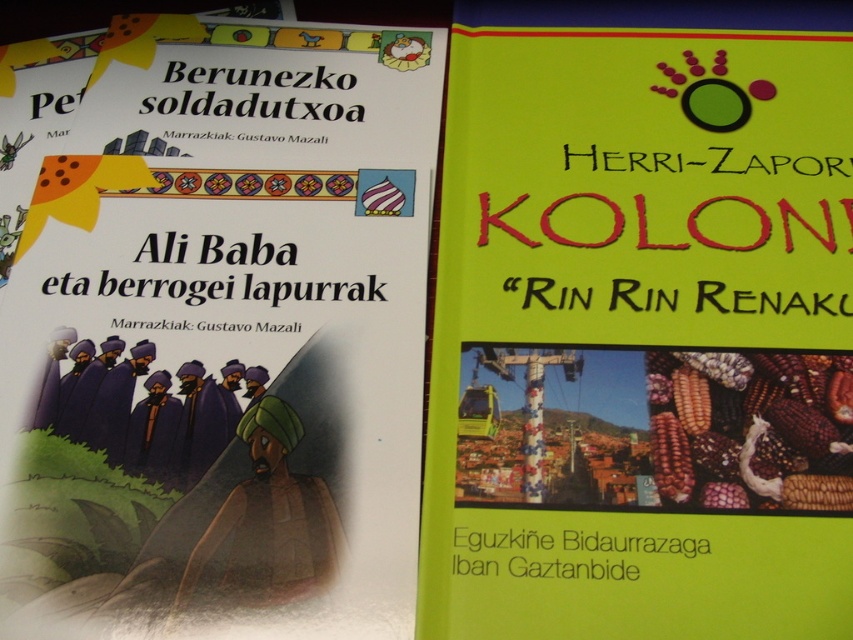
You are looking at two book covers displayed side by side. The green matte book cover at right and the matte paper book cover at left are partially overlapping. Which book cover is positioned closer to you?

The green matte book cover at right is closer to the viewer than the matte paper book cover at left.

You are organizing a library shelf and notice the green matte book cover at right and the matte paper book cover at left. Which book cover is covering part of the other?

The green matte book cover at right is positioned over the matte paper book cover at left, so it is covering part of it.

You are organizing a library shelf and need to arrange the green matte book cover at right and the matte paper book cover at left based on their height. Which book should you place on the bottom shelf to ensure proper stacking?

The matte paper book cover at left should be placed on the bottom shelf because the green matte book cover at right is taller and needs to be stacked on top to prevent it from overshadowing the shorter book.